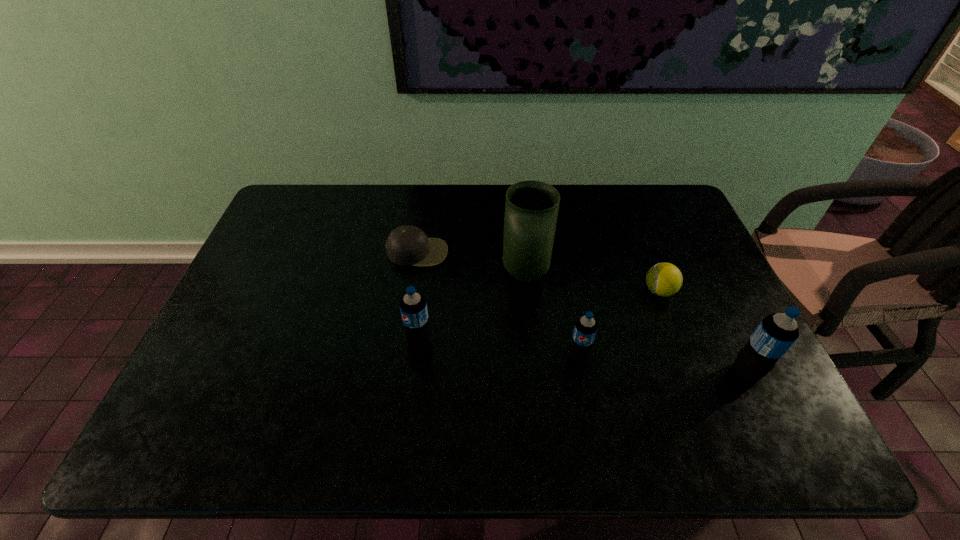
Where is `vacant space that satisfies the following two spatial constraints: 1. on the brim of the cap; 2. on the right side of the rightmost soda bottle`? This screenshot has height=540, width=960. vacant space that satisfies the following two spatial constraints: 1. on the brim of the cap; 2. on the right side of the rightmost soda bottle is located at coordinates (400, 372).

Image resolution: width=960 pixels, height=540 pixels. I want to click on vacant point that satisfies the following two spatial constraints: 1. on the front side of the fourth tallest object; 2. on the left side of the vase, so click(533, 356).